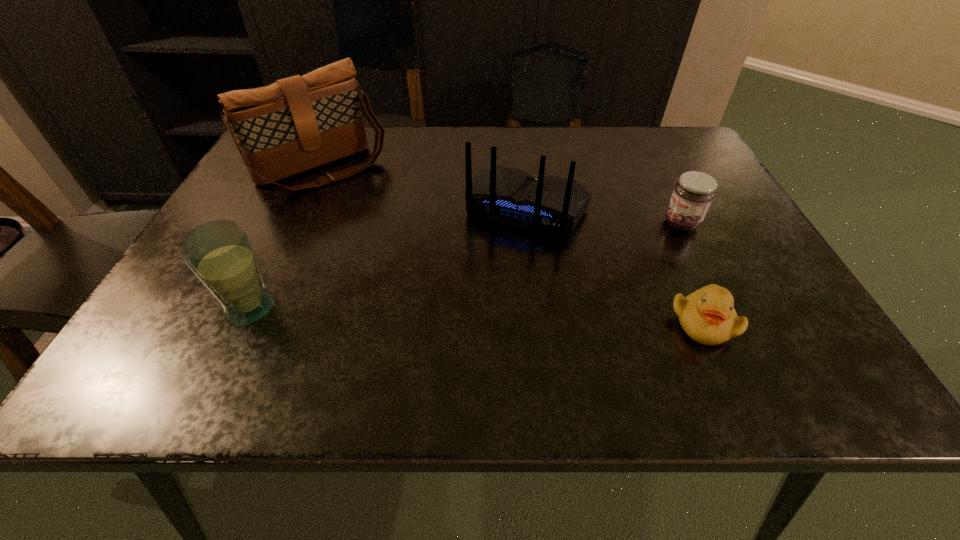
This screenshot has width=960, height=540. I want to click on free space on the desktop that is between the glass and the duckling and is positioned on the front label of the jam, so click(x=471, y=315).

Locate an element on the screen. The height and width of the screenshot is (540, 960). vacant spot on the desktop that is between the glass and the duckling and is positioned on the front-facing side of the tallest object is located at coordinates (461, 315).

Locate an element on the screen. The width and height of the screenshot is (960, 540). free space on the desktop that is between the glass and the duckling and is positioned on the back of the third object from left to right is located at coordinates (477, 315).